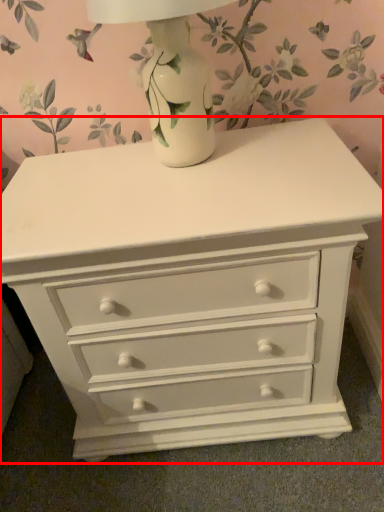
Question: From the image's perspective, what is the correct spatial relationship of chest of drawers (annotated by the red box) in relation to table lamp?

Choices:
 (A) below
 (B) above

Answer: (A)